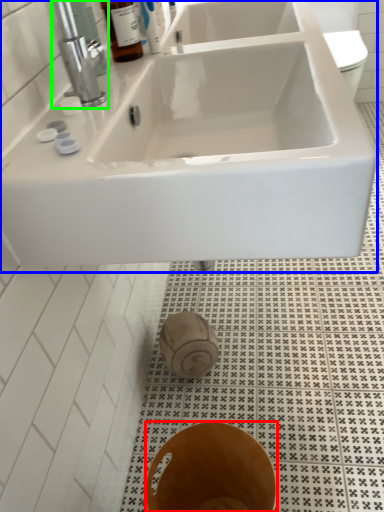
Question: Which object is positioned farthest from bidet (highlighted by a red box)? Select from sink (highlighted by a blue box) and tap (highlighted by a green box).

Choices:
 (A) sink
 (B) tap

Answer: (B)